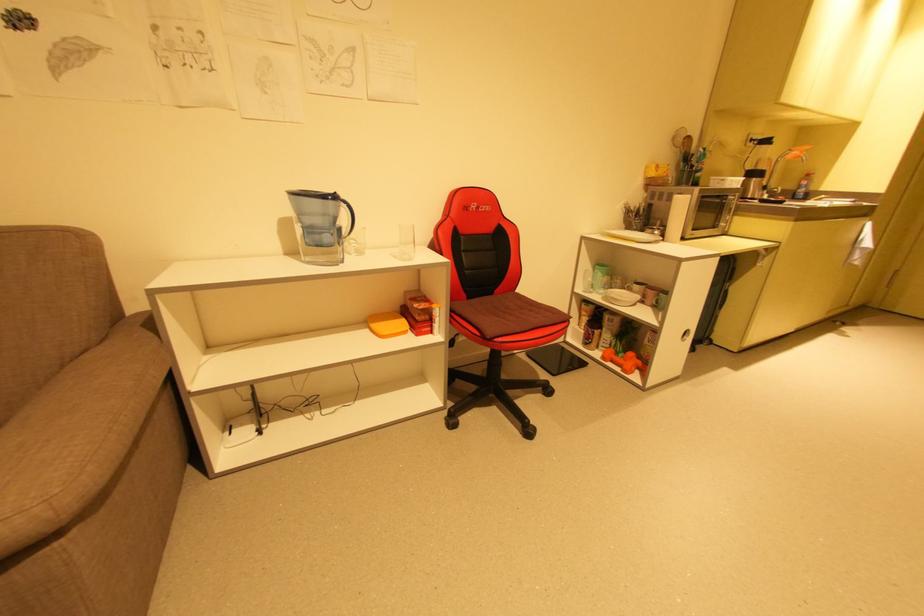
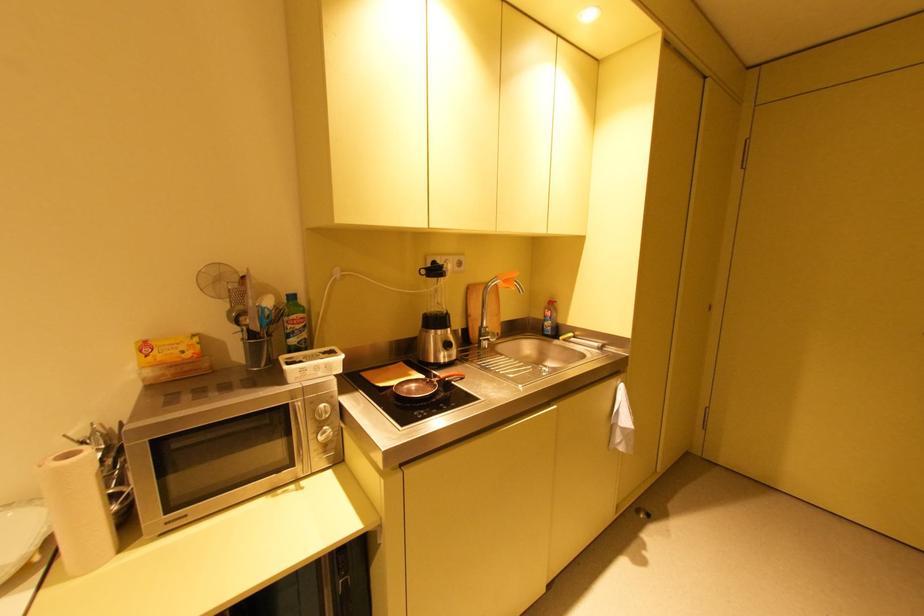
Where in the second image is the point corresponding to [805,152] from the first image?

(508, 282)